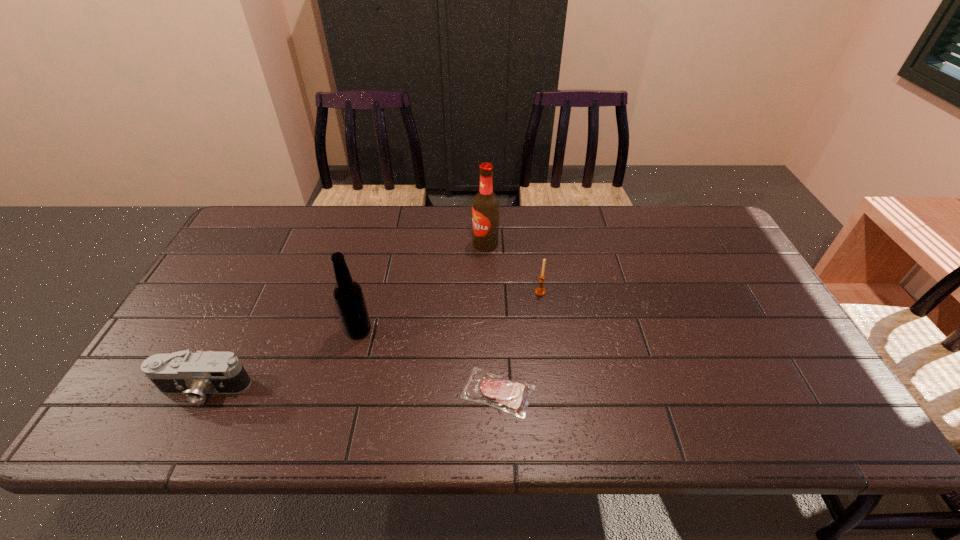
The width and height of the screenshot is (960, 540). Identify the location of vacant region at the left edge. (223, 340).

Locate an element on the screen. Image resolution: width=960 pixels, height=540 pixels. vacant space at the right edge is located at coordinates (756, 393).

In the image, there is a desktop. At what (x,y) coordinates should I click in order to perform the action: click on vacant space at the far left corner. Please return your answer as a coordinate pair (x, y). This screenshot has height=540, width=960. Looking at the image, I should click on (276, 217).

Where is `free space at the near left corner of the desktop`? The width and height of the screenshot is (960, 540). free space at the near left corner of the desktop is located at coordinates (133, 437).

At what (x,y) coordinates should I click in order to perform the action: click on vacant space at the far right corner of the desktop. Please return your answer as a coordinate pair (x, y). Looking at the image, I should click on (728, 246).

Locate an element on the screen. This screenshot has height=540, width=960. free space that is in between the farther beer bottle and the third tallest object is located at coordinates (513, 268).

Identify the location of unoccupied area between the rightmost object and the fourth tallest object. (372, 341).

Where is `empty space that is in between the farther beer bottle and the candle_holder`? empty space that is in between the farther beer bottle and the candle_holder is located at coordinates (513, 268).

At what (x,y) coordinates should I click in order to perform the action: click on vacant region between the farther beer bottle and the second object from left to right. Please return your answer as a coordinate pair (x, y). Image resolution: width=960 pixels, height=540 pixels. Looking at the image, I should click on (422, 287).

Identify the location of vacant space that's between the candle_holder and the second shortest object. (372, 341).